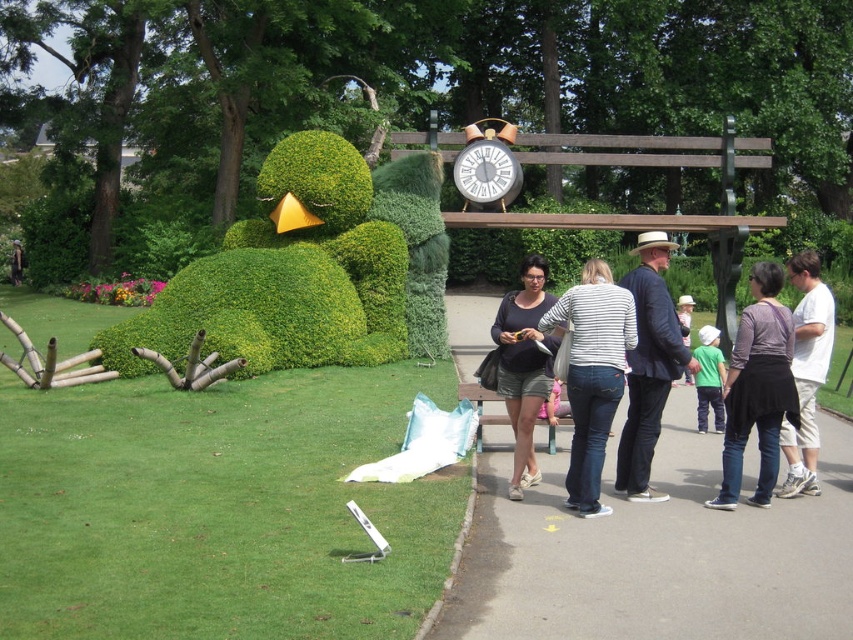
Question: Can you confirm if green cotton shirt at lower right is positioned above light brown leather jacket at center?

Choices:
 (A) yes
 (B) no

Answer: (B)

Question: Among these objects, which one is nearest to the camera?

Choices:
 (A) matte black topiary at center
 (B) green bushy hedge at left
 (C) dark gray sweater at center
 (D) light brown leather jacket at center

Answer: (C)

Question: Estimate the real-world distances between objects in this image. Which object is farther from the light brown leather jacket at center?

Choices:
 (A) white cotton shirt at center
 (B) matte black topiary at center

Answer: (A)

Question: Is striped cotton shirt at center positioned at the back of green cotton shirt at lower right?

Choices:
 (A) no
 (B) yes

Answer: (A)

Question: Which of the following is the closest to the observer?

Choices:
 (A) green bushy hedge at left
 (B) striped cotton shirt at center

Answer: (B)

Question: Is dark blue cotton jacket at center to the left of matte black topiary at center from the viewer's perspective?

Choices:
 (A) yes
 (B) no

Answer: (B)